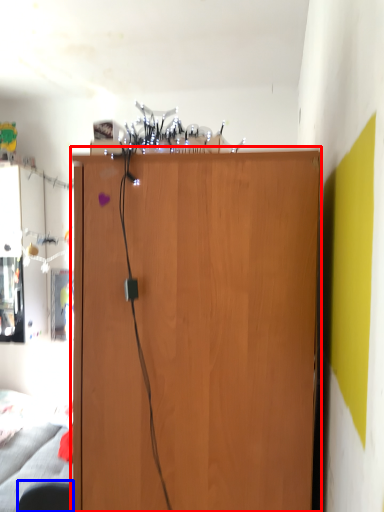
Question: Which of the following is the closest to the observer, cupboard (highlighted by a red box) or swivel chair (highlighted by a blue box)?

Choices:
 (A) cupboard
 (B) swivel chair

Answer: (A)